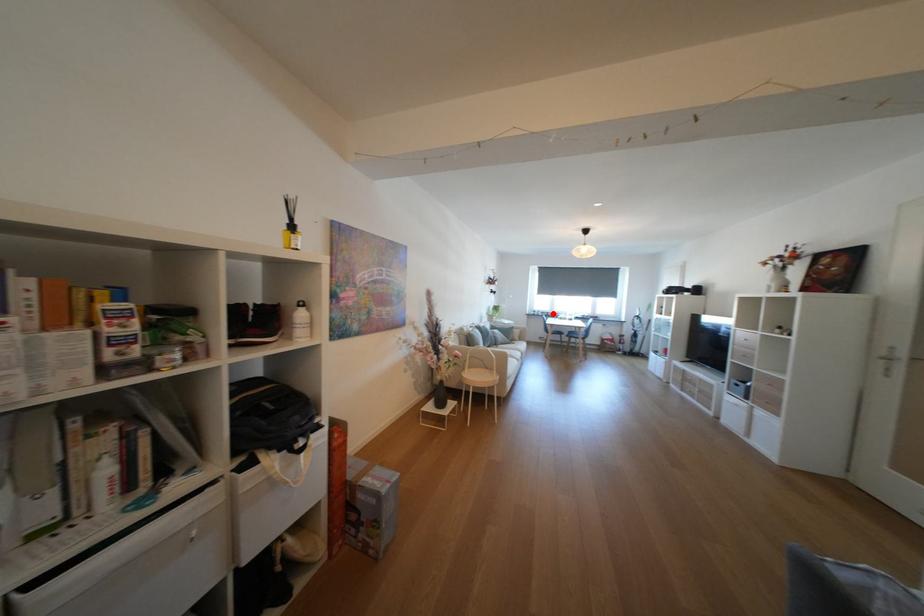
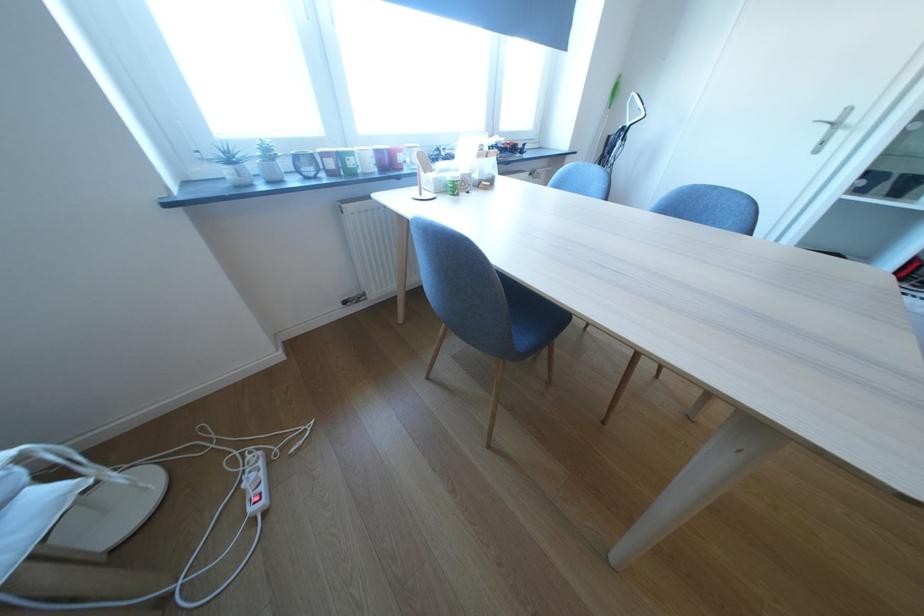
Find the pixel in the second image that matches the highlighted location in the first image.

(308, 160)